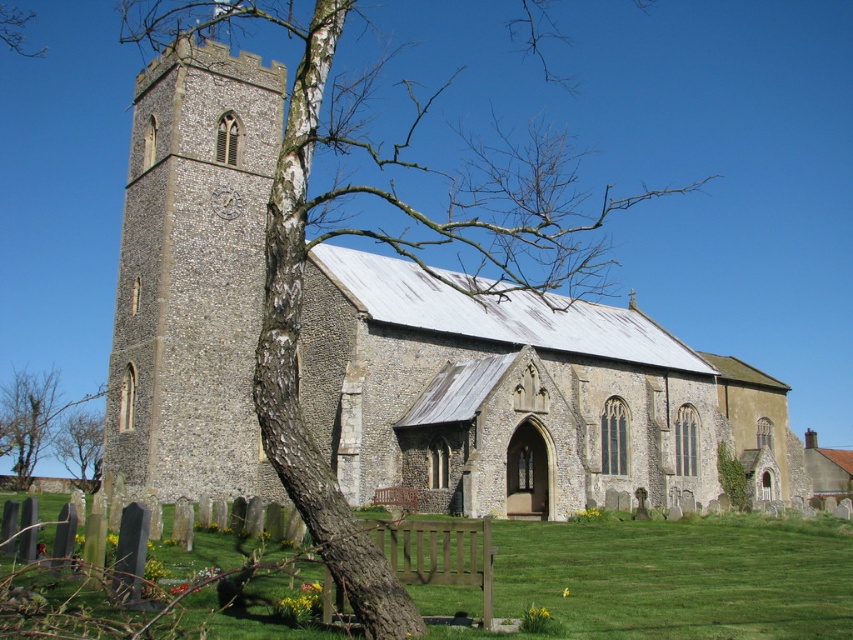
Question: Which of the following is the farthest from the observer?

Choices:
 (A) bare wood tree trunk at left
 (B) bark textured tree at center-left
 (C) stone tower at left

Answer: (A)

Question: Does stone tower at left come in front of bark textured tree at center-left?

Choices:
 (A) yes
 (B) no

Answer: (B)

Question: Does green grass at lower center appear under bark textured tree at center-left?

Choices:
 (A) no
 (B) yes

Answer: (B)

Question: Which point is farther to the camera?

Choices:
 (A) [300, 116]
 (B) [6, 451]

Answer: (B)

Question: Which of the following is the closest to the observer?

Choices:
 (A) (323, 38)
 (B) (51, 449)

Answer: (A)

Question: In this image, where is bark textured tree at center-left located relative to brown bark tree at lower left?

Choices:
 (A) above
 (B) below

Answer: (A)